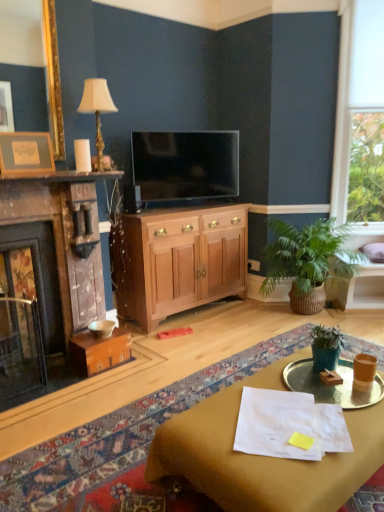
Find the location of a particular element. vacant space to the left of green matte plant pot at center, which is counted as the 2th houseplant, starting from the back is located at coordinates (290, 371).